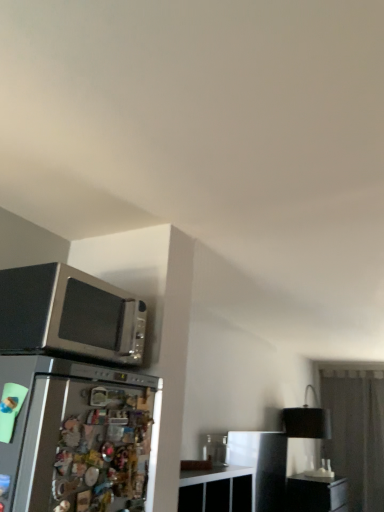
Question: Considering the positions of black matte lampshade at right and satin black microwave at upper left in the image, is black matte lampshade at right taller or shorter than satin black microwave at upper left?

Choices:
 (A) tall
 (B) short

Answer: (A)

Question: Considering the positions of point (317, 430) and point (38, 335), is point (317, 430) closer or farther from the camera than point (38, 335)?

Choices:
 (A) farther
 (B) closer

Answer: (A)

Question: Considering the real-world distances, which object is closest to the black matte file cabinet at lower right?

Choices:
 (A) black matte lampshade at right
 (B) satin black microwave at upper left
 (C) transparent glass door at right

Answer: (A)

Question: Which object is positioned closest to the satin black microwave at upper left?

Choices:
 (A) black matte lampshade at right
 (B) black matte file cabinet at lower right
 (C) transparent glass door at right

Answer: (A)